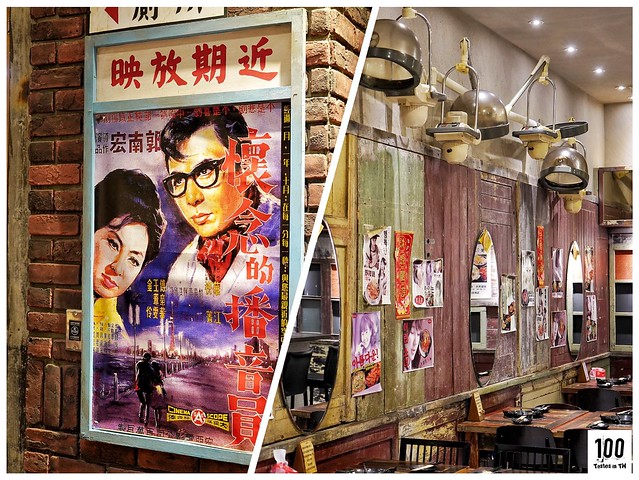
This screenshot has width=639, height=480. Identify the location of 3rd oval mirror. (578, 314).